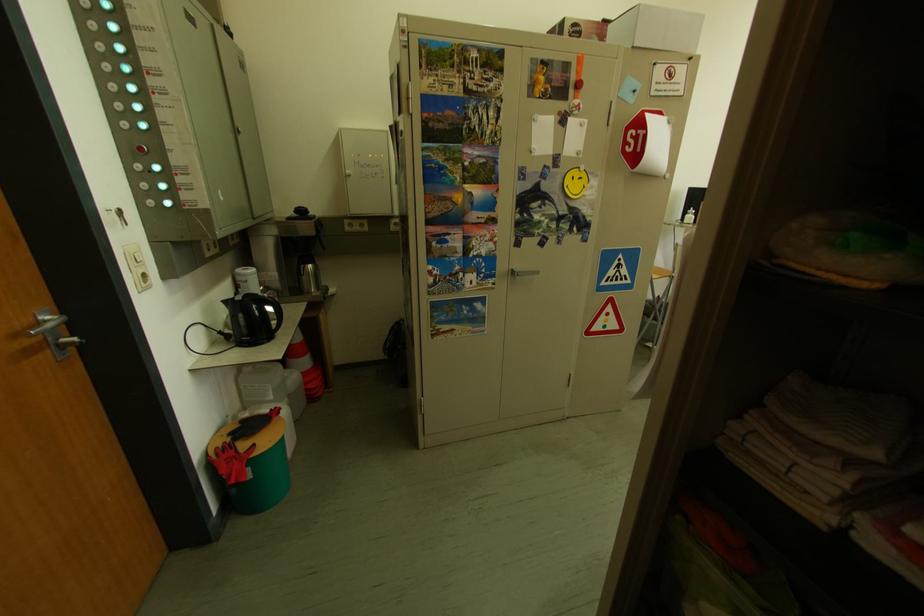
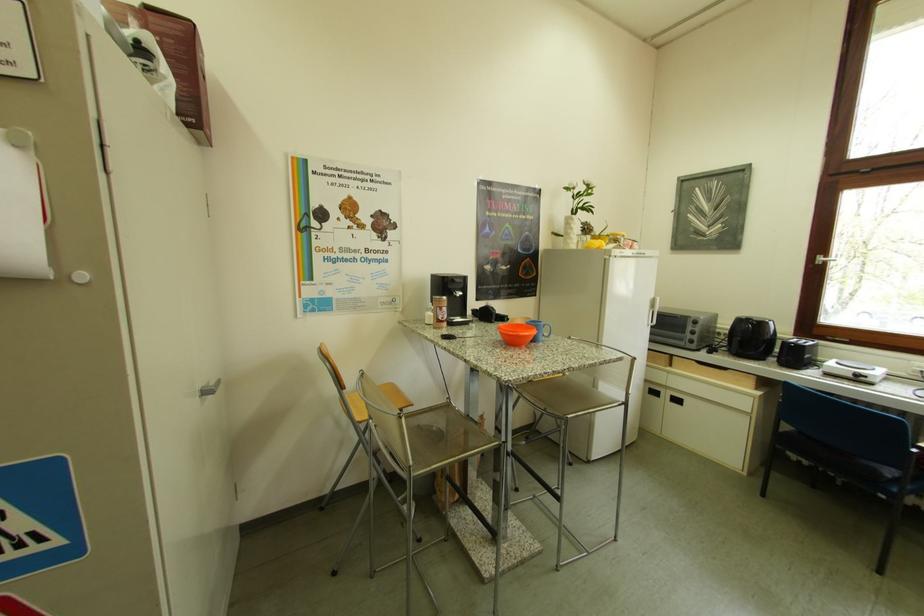
The images are taken continuously from a first-person perspective. In which direction are you moving?

The movement direction of the cameraman is right, forward.